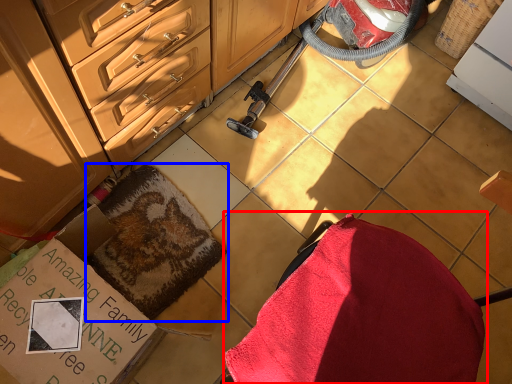
Question: Which object appears farthest to the camera in this image, swivel chair (highlighted by a red box) or blanket (highlighted by a blue box)?

Choices:
 (A) swivel chair
 (B) blanket

Answer: (B)